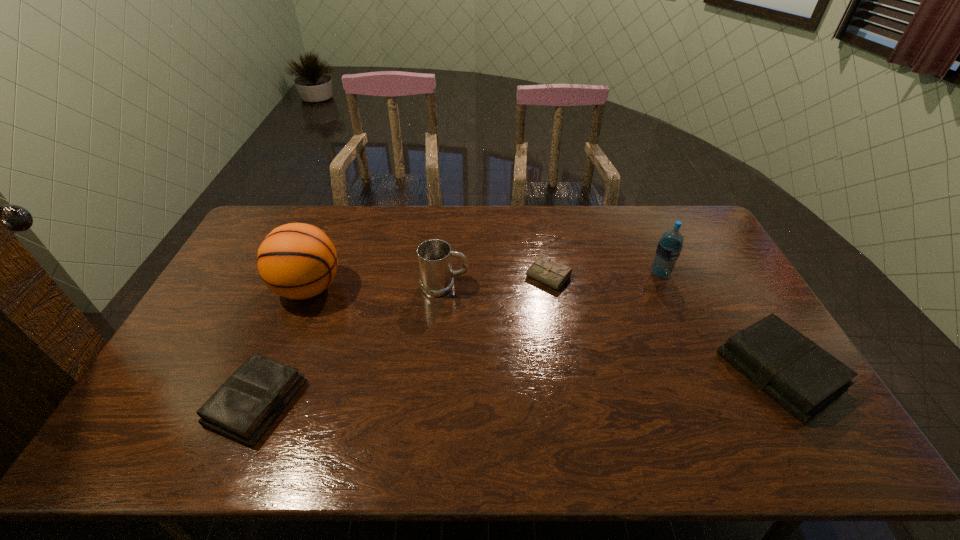
At what (x,y) coordinates should I click in order to perform the action: click on vacant space that satisfies the following two spatial constraints: 1. on the front side of the water bottle; 2. on the side of the fourth object from right to left with the handle. Please return your answer as a coordinate pair (x, y). Looking at the image, I should click on (665, 286).